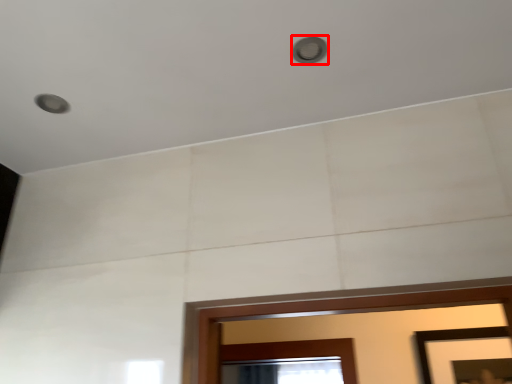
Question: From the image's perspective, where is light (annotated by the red box) located relative to picture frame?

Choices:
 (A) above
 (B) below

Answer: (A)